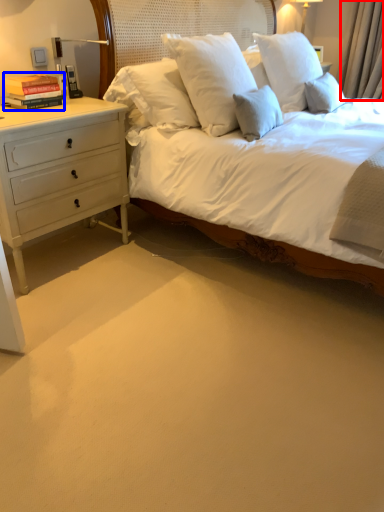
Question: Which of the following is the farthest to the observer, curtain (highlighted by a red box) or book (highlighted by a blue box)?

Choices:
 (A) curtain
 (B) book

Answer: (A)